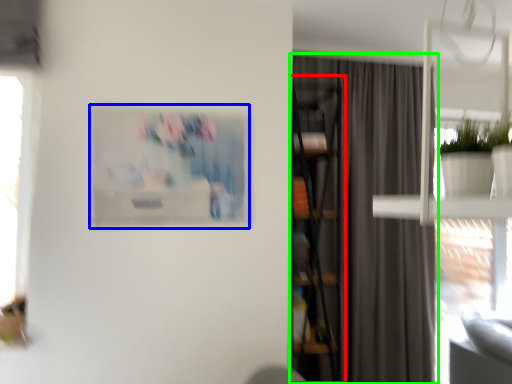
Question: Which object is the farthest from bookcase (highlighted by a red box)? Choose among these: picture frame (highlighted by a blue box) or curtain (highlighted by a green box).

Choices:
 (A) picture frame
 (B) curtain

Answer: (A)